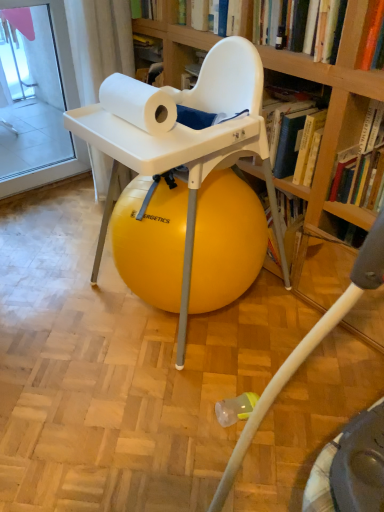
Where is `free space in front of yellow rubber ball at center`? free space in front of yellow rubber ball at center is located at coordinates (175, 404).